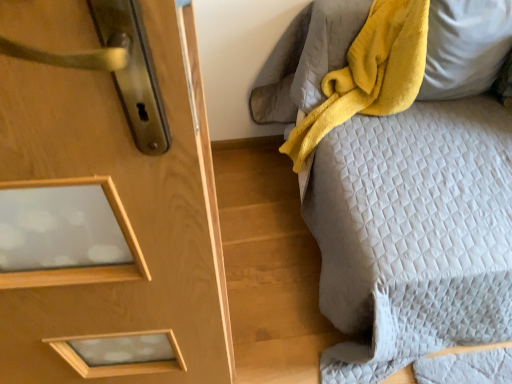
Question: Is the depth of yellow soft pillow at upper right less than that of yellow plush blanket at upper right?

Choices:
 (A) no
 (B) yes

Answer: (A)

Question: Can you confirm if yellow soft pillow at upper right is shorter than yellow plush blanket at upper right?

Choices:
 (A) no
 (B) yes

Answer: (B)

Question: Is yellow soft pillow at upper right to the right of yellow plush blanket at upper right from the viewer's perspective?

Choices:
 (A) yes
 (B) no

Answer: (A)

Question: From the image's perspective, is yellow soft pillow at upper right beneath yellow plush blanket at upper right?

Choices:
 (A) no
 (B) yes

Answer: (A)

Question: From a real-world perspective, is yellow soft pillow at upper right located beneath yellow plush blanket at upper right?

Choices:
 (A) yes
 (B) no

Answer: (B)

Question: Visually, is quilted gray bedspread at right positioned to the left or to the right of yellow soft pillow at upper right?

Choices:
 (A) left
 (B) right

Answer: (A)

Question: Considering the positions of quilted gray bedspread at right and yellow soft pillow at upper right in the image, is quilted gray bedspread at right bigger or smaller than yellow soft pillow at upper right?

Choices:
 (A) big
 (B) small

Answer: (A)

Question: From a real-world perspective, relative to yellow soft pillow at upper right, is quilted gray bedspread at right vertically above or below?

Choices:
 (A) above
 (B) below

Answer: (B)

Question: From the image's perspective, is quilted gray bedspread at right above or below yellow soft pillow at upper right?

Choices:
 (A) above
 (B) below

Answer: (B)

Question: From their relative heights in the image, would you say quilted gray bedspread at right is taller or shorter than yellow plush blanket at upper right?

Choices:
 (A) short
 (B) tall

Answer: (B)

Question: From a real-world perspective, is quilted gray bedspread at right physically located above or below yellow plush blanket at upper right?

Choices:
 (A) above
 (B) below

Answer: (B)

Question: Is quilted gray bedspread at right inside or outside of yellow plush blanket at upper right?

Choices:
 (A) inside
 (B) outside

Answer: (B)

Question: Is quilted gray bedspread at right bigger or smaller than yellow plush blanket at upper right?

Choices:
 (A) big
 (B) small

Answer: (A)

Question: Visually, is yellow soft pillow at upper right positioned to the left or to the right of quilted gray bedspread at right?

Choices:
 (A) right
 (B) left

Answer: (A)

Question: From a real-world perspective, relative to quilted gray bedspread at right, is yellow soft pillow at upper right vertically above or below?

Choices:
 (A) below
 (B) above

Answer: (B)